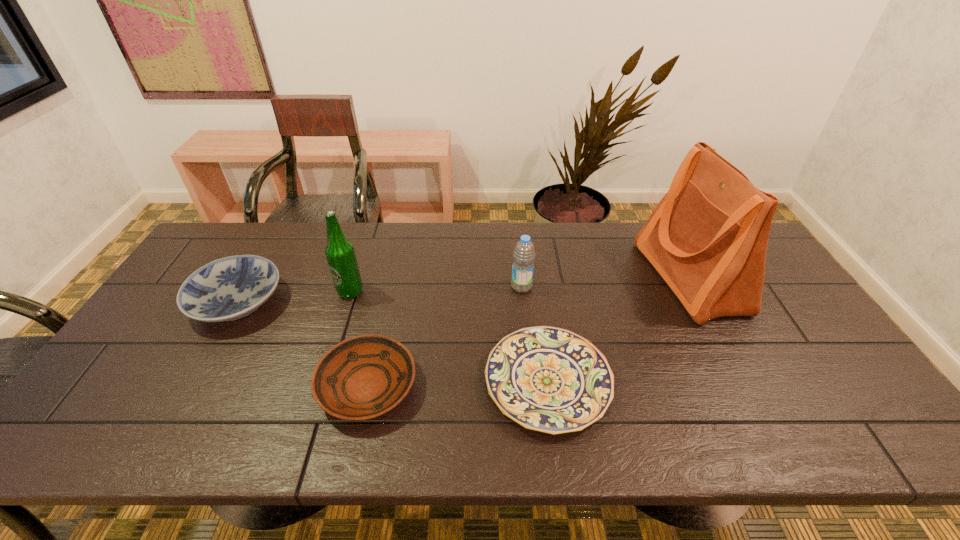
Where is `free point between the leftmost plate and the rightmost object`? free point between the leftmost plate and the rightmost object is located at coordinates (464, 289).

Locate an element on the screen. Image resolution: width=960 pixels, height=540 pixels. vacant region between the tallest object and the leftmost object is located at coordinates (464, 289).

Select which object appears as the third closest to the second tallest plate. Please provide its 2D coordinates. Your answer should be formatted as a tuple, i.e. [(x, y)], where the tuple contains the x and y coordinates of a point satisfying the conditions above.

[(226, 289)]

Locate which object ranks fifth in proximity to the shortest plate. Please provide its 2D coordinates. Your answer should be formatted as a tuple, i.e. [(x, y)], where the tuple contains the x and y coordinates of a point satisfying the conditions above.

[(226, 289)]

Choose which plate is the second nearest neighbor to the shortest object. Please provide its 2D coordinates. Your answer should be formatted as a tuple, i.e. [(x, y)], where the tuple contains the x and y coordinates of a point satisfying the conditions above.

[(226, 289)]

Locate an element on the screen. The image size is (960, 540). plate that is the closest one to the water bottle is located at coordinates (552, 380).

At what (x,y) coordinates should I click in order to perform the action: click on vacant space that satisfies the following two spatial constraints: 1. on the back side of the rightmost object; 2. on the right side of the second tallest plate. Please return your answer as a coordinate pair (x, y). The width and height of the screenshot is (960, 540). Looking at the image, I should click on (392, 277).

Where is `blank space that satisfies the following two spatial constraints: 1. on the label of the second shortest object; 2. on the right side of the fifth shortest object`? The height and width of the screenshot is (540, 960). blank space that satisfies the following two spatial constraints: 1. on the label of the second shortest object; 2. on the right side of the fifth shortest object is located at coordinates (321, 386).